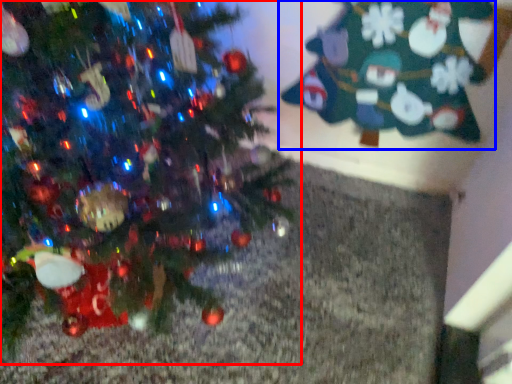
Question: Which point is closer to the camera, christmas tree (highlighted by a red box) or christmas tree (highlighted by a blue box)?

Choices:
 (A) christmas tree
 (B) christmas tree

Answer: (A)